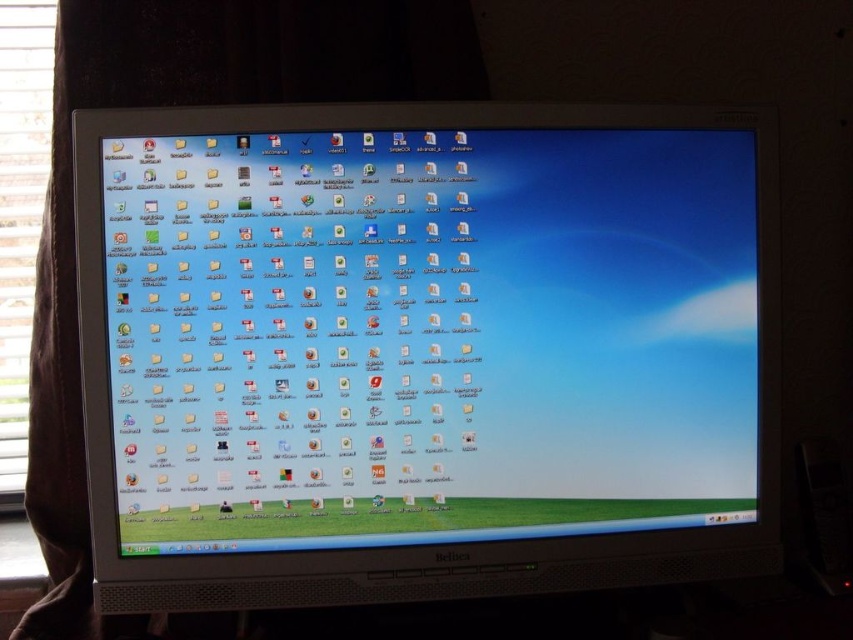
You are a technician trying to install a new cable that requires reaching from the white glossy monitor at center to the white wood window at left. The cable you have is 25 inches long. Will the cable be sufficient to connect them?

The distance between the white glossy monitor at center and the white wood window at left is 26.33 inches. Since the cable is only 25 inches long, it will not be sufficient to cover the required distance.

You are a technician adjusting the monitor. You need to reach both the point at (689, 460) and the point at (4, 403). Which point should you reach first to minimize your movement?

You should reach the point at (689, 460) first because it is closer to the camera than the point at (4, 403).

You are setting up a new desk in your study. You have both the white glossy monitor at center and the white wood window at left. Which object should you place closer to the wall to ensure they both fit on your desk?

The white wood window at left is smaller, so place it closer to the wall to accommodate the larger white glossy monitor at center.